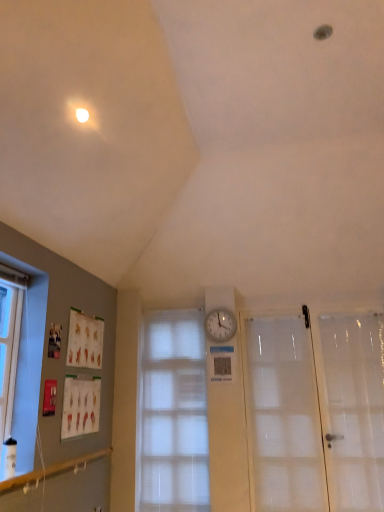
Question: Does translucent fabric window at center have a larger size compared to transparent plastic screen door at right?

Choices:
 (A) yes
 (B) no

Answer: (A)

Question: Is translucent fabric window at center smaller than transparent plastic screen door at right?

Choices:
 (A) no
 (B) yes

Answer: (A)

Question: Is translucent fabric window at center further to the viewer compared to transparent plastic screen door at right?

Choices:
 (A) no
 (B) yes

Answer: (B)

Question: Is translucent fabric window at center placed right next to transparent plastic screen door at right?

Choices:
 (A) no
 (B) yes

Answer: (A)

Question: Considering the relative positions of translucent fabric window at center and transparent plastic screen door at right in the image provided, is translucent fabric window at center to the left of transparent plastic screen door at right from the viewer's perspective?

Choices:
 (A) yes
 (B) no

Answer: (A)

Question: Is translucent fabric window at center not within transparent plastic screen door at right?

Choices:
 (A) no
 (B) yes

Answer: (B)

Question: From a real-world perspective, is white frosted glass door at right physically above transparent plastic screen door at right?

Choices:
 (A) no
 (B) yes

Answer: (B)

Question: From a real-world perspective, is white frosted glass door at right under transparent plastic screen door at right?

Choices:
 (A) yes
 (B) no

Answer: (B)

Question: Can we say white frosted glass door at right lies outside transparent plastic screen door at right?

Choices:
 (A) no
 (B) yes

Answer: (B)

Question: Can you confirm if white frosted glass door at right is positioned to the left of transparent plastic screen door at right?

Choices:
 (A) yes
 (B) no

Answer: (A)

Question: Is white frosted glass door at right turned away from transparent plastic screen door at right?

Choices:
 (A) no
 (B) yes

Answer: (A)

Question: From the image's perspective, would you say white frosted glass door at right is shown under transparent plastic screen door at right?

Choices:
 (A) yes
 (B) no

Answer: (A)

Question: Is transparent plastic screen door at right not inside translucent fabric window at center?

Choices:
 (A) no
 (B) yes

Answer: (B)